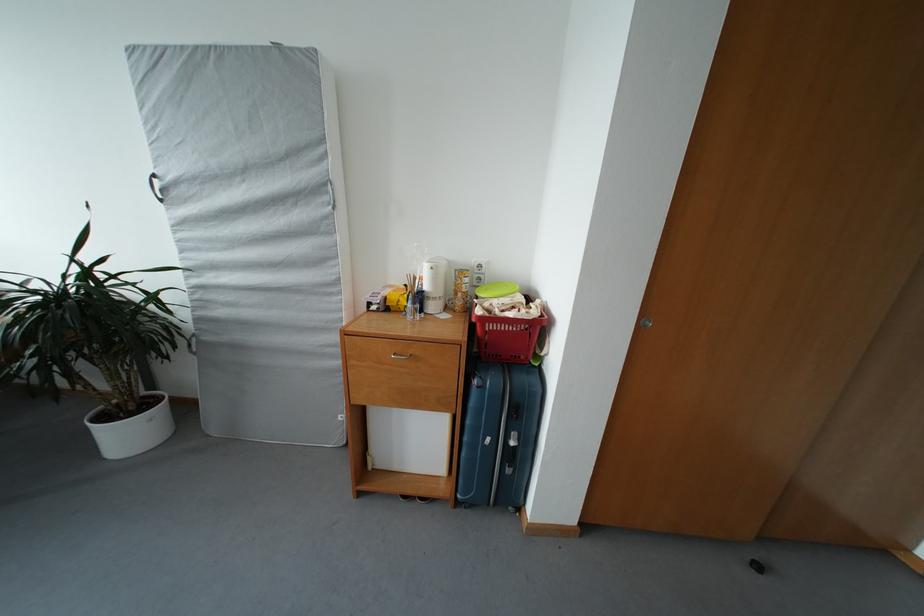
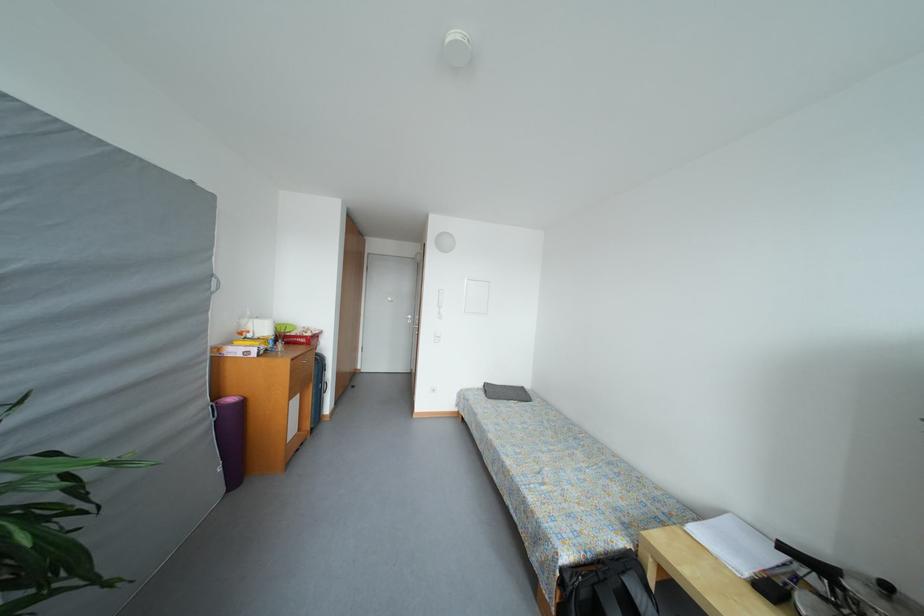
Question: I am providing you with two images of the same scene from different viewpoints. After the viewpoint changes to image2, which objects are now occluded?

Choices:
 (A) door handle
 (B) grey cushion
 (C) red basket handle
 (D) penguin stuffed toy

Answer: (C)